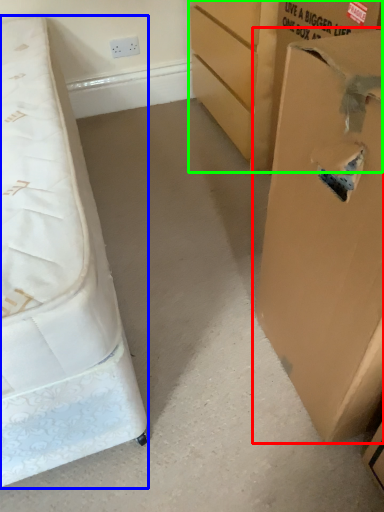
Question: Which object is positioned farthest from cardboard box (highlighted by a red box)? Select from bed (highlighted by a blue box) and cardboard box (highlighted by a green box).

Choices:
 (A) bed
 (B) cardboard box

Answer: (B)